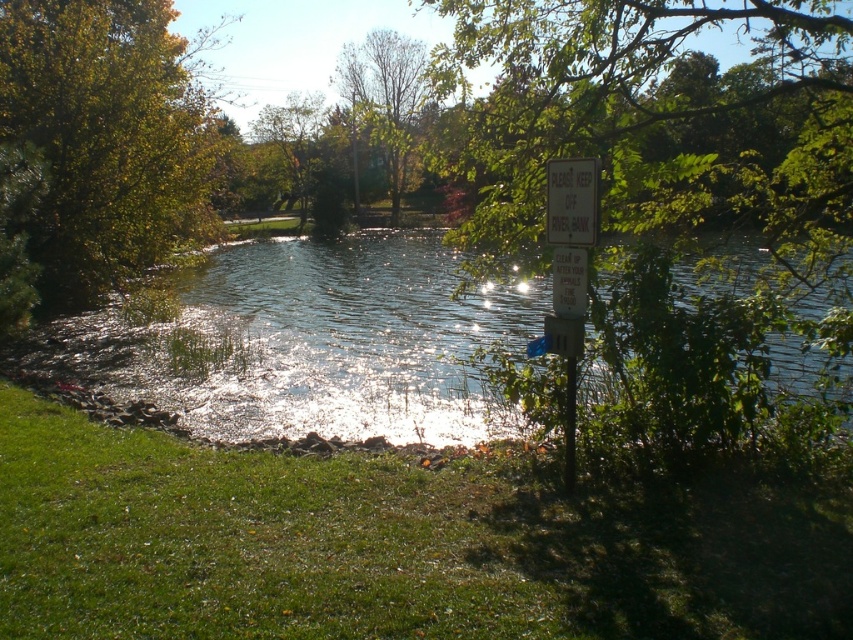
Who is more distant from viewer, [368,387] or [572,257]?

Point [368,387]

Is clear water at center to the right of white plastic sign at center-right from the viewer's perspective?

Yes, clear water at center is to the right of white plastic sign at center-right.

Who is more forward, (428, 310) or (567, 276)?

Point (567, 276) is in front.

Locate an element on the screen. This screenshot has width=853, height=640. clear water at center is located at coordinates (320, 340).

Is point (30, 35) positioned behind point (577, 228)?

Yes, point (30, 35) is farther from viewer.

Does green leafy tree at left have a lesser height compared to white paper sign at upper right?

No, green leafy tree at left is not shorter than white paper sign at upper right.

Where is `green leafy tree at left`? The image size is (853, 640). green leafy tree at left is located at coordinates (96, 150).

Does clear water at center come behind green leafy tree at left?

That is False.

Who is lower down, clear water at center or green leafy tree at left?

clear water at center

Where is `clear water at center`? The width and height of the screenshot is (853, 640). clear water at center is located at coordinates (320, 340).